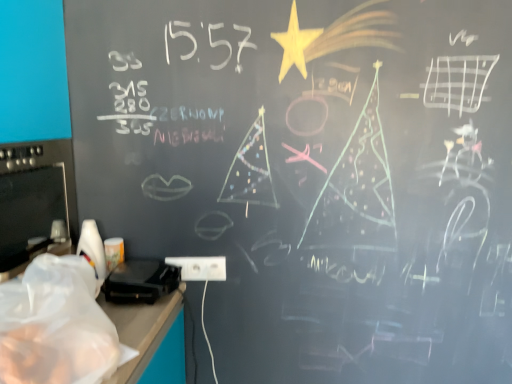
Question: From a real-world perspective, is black plastic toaster at lower left above or below white plastic electric outlet at lower center?

Choices:
 (A) below
 (B) above

Answer: (B)

Question: Would you say black plastic toaster at lower left is inside or outside white plastic electric outlet at lower center?

Choices:
 (A) outside
 (B) inside

Answer: (A)

Question: Considering the real-world distances, which object is farthest from the transparent plastic bag at lower left?

Choices:
 (A) white plastic electric outlet at lower center
 (B) black plastic toaster at lower left

Answer: (A)

Question: Considering the real-world distances, which object is farthest from the white plastic electric outlet at lower center?

Choices:
 (A) black plastic toaster at lower left
 (B) transparent plastic bag at lower left

Answer: (B)